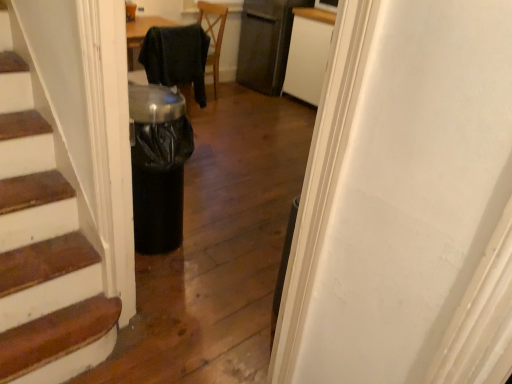
Question: Considering the relative sizes of white matte cabinet at upper center and satin black refrigerator at upper center in the image provided, is white matte cabinet at upper center wider than satin black refrigerator at upper center?

Choices:
 (A) no
 (B) yes

Answer: (B)

Question: From a real-world perspective, is white matte cabinet at upper center over satin black refrigerator at upper center?

Choices:
 (A) yes
 (B) no

Answer: (B)

Question: Are white matte cabinet at upper center and satin black refrigerator at upper center far apart?

Choices:
 (A) yes
 (B) no

Answer: (B)

Question: Considering the relative sizes of white matte cabinet at upper center and satin black refrigerator at upper center in the image provided, is white matte cabinet at upper center shorter than satin black refrigerator at upper center?

Choices:
 (A) yes
 (B) no

Answer: (A)

Question: Would you say white matte cabinet at upper center is outside satin black refrigerator at upper center?

Choices:
 (A) yes
 (B) no

Answer: (A)

Question: Considering the relative positions of black fabric chair at center and satin black refrigerator at upper center in the image provided, is black fabric chair at center to the left or to the right of satin black refrigerator at upper center?

Choices:
 (A) left
 (B) right

Answer: (A)

Question: In terms of size, does black fabric chair at center appear bigger or smaller than satin black refrigerator at upper center?

Choices:
 (A) big
 (B) small

Answer: (B)

Question: From the image's perspective, relative to satin black refrigerator at upper center, is black fabric chair at center above or below?

Choices:
 (A) above
 (B) below

Answer: (B)

Question: Is black fabric chair at center taller or shorter than satin black refrigerator at upper center?

Choices:
 (A) tall
 (B) short

Answer: (B)

Question: From the image's perspective, is black fabric chair at center located above or below white matte cabinet at upper center?

Choices:
 (A) below
 (B) above

Answer: (A)

Question: Considering the positions of point (x=167, y=31) and point (x=301, y=87), is point (x=167, y=31) closer or farther from the camera than point (x=301, y=87)?

Choices:
 (A) farther
 (B) closer

Answer: (B)

Question: From a real-world perspective, is black fabric chair at center positioned above or below white matte cabinet at upper center?

Choices:
 (A) above
 (B) below

Answer: (A)

Question: In terms of height, does black fabric chair at center look taller or shorter compared to white matte cabinet at upper center?

Choices:
 (A) tall
 (B) short

Answer: (B)

Question: From a real-world perspective, is white matte cabinet at upper center above or below satin black refrigerator at upper center?

Choices:
 (A) above
 (B) below

Answer: (B)

Question: Considering the positions of white matte cabinet at upper center and satin black refrigerator at upper center in the image, is white matte cabinet at upper center wider or thinner than satin black refrigerator at upper center?

Choices:
 (A) wide
 (B) thin

Answer: (A)